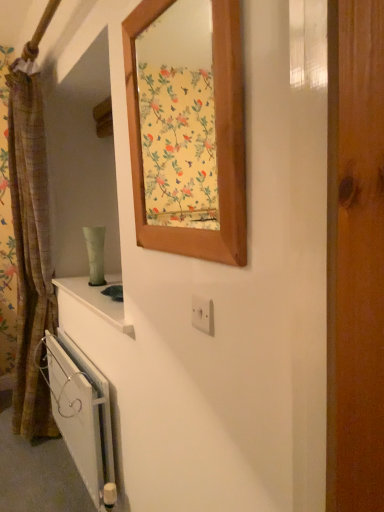
Question: Does wooden frame at upper center lie behind white metallic radiator at lower left?

Choices:
 (A) no
 (B) yes

Answer: (A)

Question: Considering the relative positions of wooden frame at upper center and white metallic radiator at lower left in the image provided, is wooden frame at upper center in front of white metallic radiator at lower left?

Choices:
 (A) no
 (B) yes

Answer: (B)

Question: Could you tell me if wooden frame at upper center is turned towards white metallic radiator at lower left?

Choices:
 (A) yes
 (B) no

Answer: (B)

Question: Is white metallic radiator at lower left at the back of wooden frame at upper center?

Choices:
 (A) yes
 (B) no

Answer: (B)

Question: Does wooden frame at upper center have a greater height compared to white metallic radiator at lower left?

Choices:
 (A) yes
 (B) no

Answer: (A)

Question: Considering the positions of wooden frame at upper center and white metallic radiator at lower left in the image, is wooden frame at upper center wider or thinner than white metallic radiator at lower left?

Choices:
 (A) wide
 (B) thin

Answer: (B)

Question: Considering the positions of wooden frame at upper center and white metallic radiator at lower left in the image, is wooden frame at upper center bigger or smaller than white metallic radiator at lower left?

Choices:
 (A) small
 (B) big

Answer: (A)

Question: From the image's perspective, relative to white metallic radiator at lower left, is wooden frame at upper center above or below?

Choices:
 (A) above
 (B) below

Answer: (A)

Question: Visually, is wooden frame at upper center positioned to the left or to the right of white metallic radiator at lower left?

Choices:
 (A) right
 (B) left

Answer: (A)

Question: In terms of height, does brown textured curtain at left look taller or shorter compared to white metallic radiator at lower left?

Choices:
 (A) tall
 (B) short

Answer: (A)

Question: Is brown textured curtain at left bigger or smaller than white metallic radiator at lower left?

Choices:
 (A) big
 (B) small

Answer: (A)

Question: Considering the positions of point (26, 120) and point (86, 485), is point (26, 120) closer or farther from the camera than point (86, 485)?

Choices:
 (A) closer
 (B) farther

Answer: (B)

Question: In the image, is brown textured curtain at left positioned in front of or behind white metallic radiator at lower left?

Choices:
 (A) front
 (B) behind

Answer: (B)

Question: Considering the positions of white plastic electric outlet at center and wooden frame at upper center in the image, is white plastic electric outlet at center bigger or smaller than wooden frame at upper center?

Choices:
 (A) small
 (B) big

Answer: (A)

Question: Is white plastic electric outlet at center wider or thinner than wooden frame at upper center?

Choices:
 (A) wide
 (B) thin

Answer: (B)